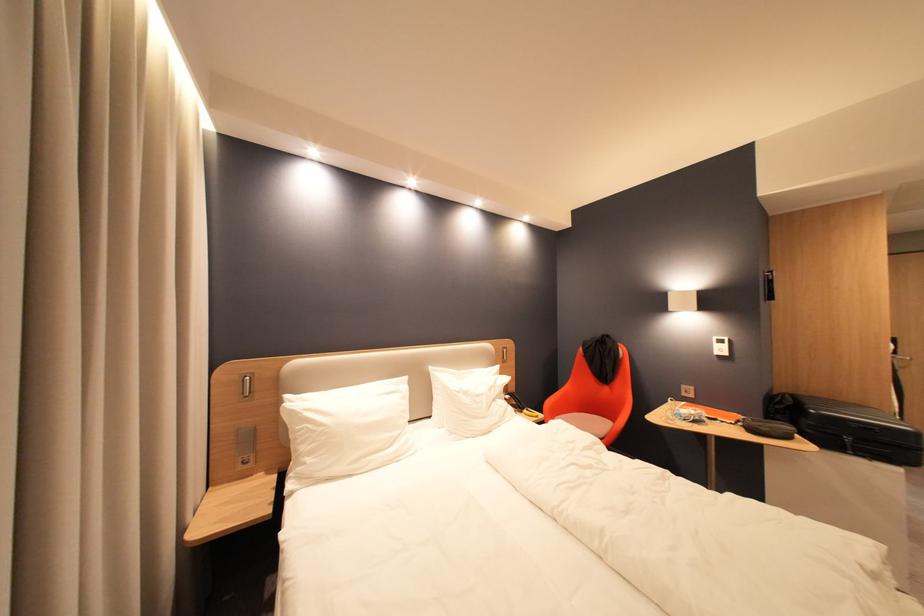
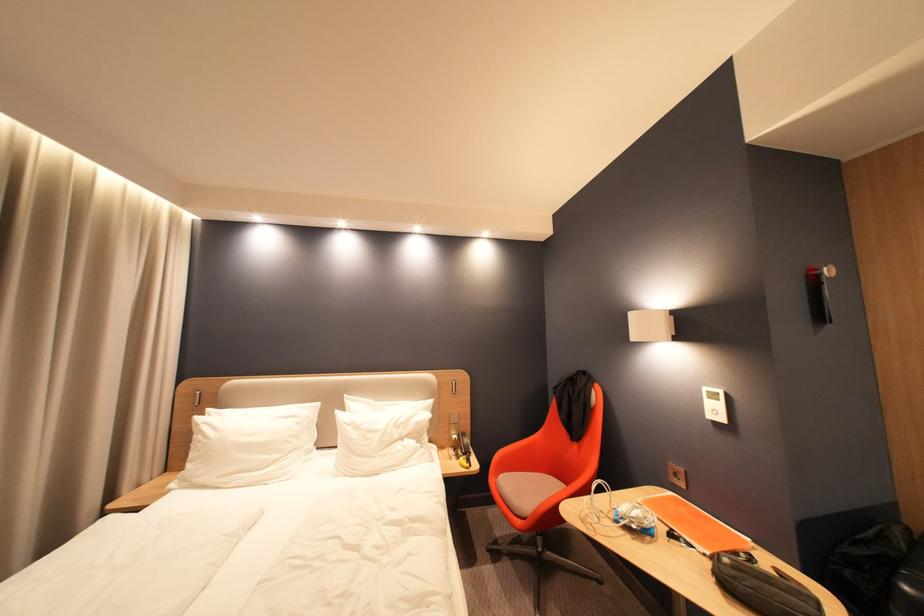
The point at (781, 274) is marked in the first image. Where is the corresponding point in the second image?

(830, 270)